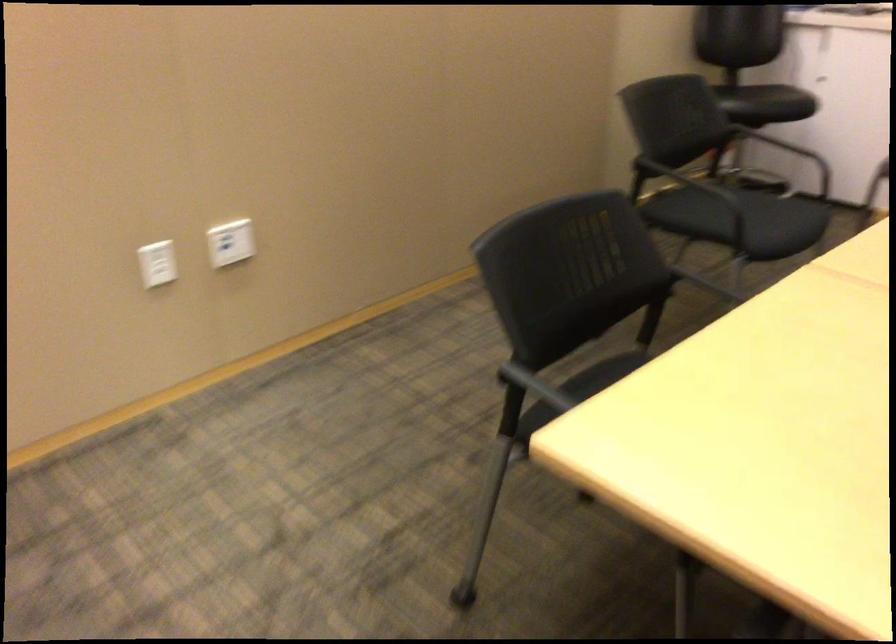
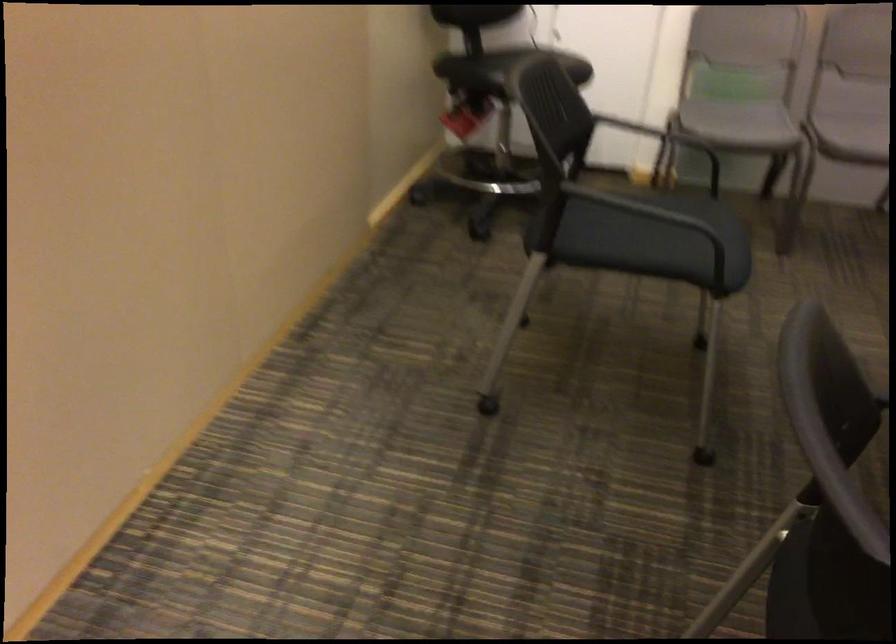
The point at [730,218] is marked in the first image. Where is the corresponding point in the second image?

(655, 240)